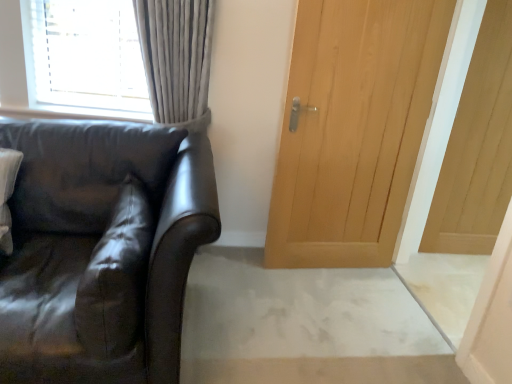
Question: Visually, is matte black leather couch at left positioned to the left or to the right of light wood paneling at right, positioned as the 1th door in right-to-left order?

Choices:
 (A) right
 (B) left

Answer: (B)

Question: From their relative heights in the image, would you say matte black leather couch at left is taller or shorter than light wood paneling at right, which is the 2th door in left-to-right order?

Choices:
 (A) short
 (B) tall

Answer: (A)

Question: Which of these objects is positioned farthest from the suede-like brown pillow at left?

Choices:
 (A) light wood paneling at right, positioned as the 1th door in right-to-left order
 (B) matte black leather couch at left
 (C) light wood door at center, acting as the 2th door starting from the right

Answer: (A)

Question: Which is nearer to the matte black leather couch at left?

Choices:
 (A) light wood door at center, acting as the 2th door starting from the right
 (B) light wood paneling at right, which is the 2th door in left-to-right order
 (C) suede-like brown pillow at left

Answer: (C)